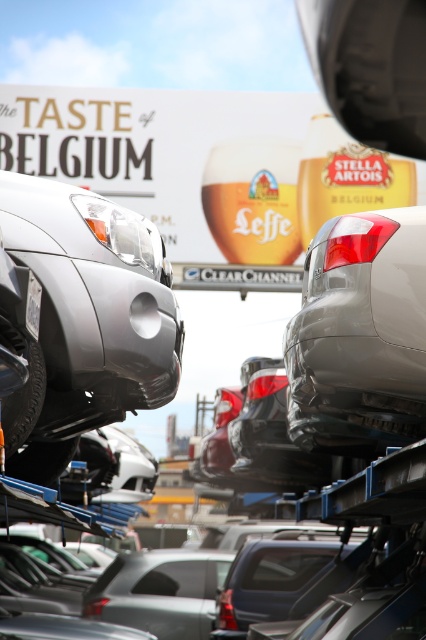
Question: Is satin silver car at left to the right of white plastic license plate at center from the viewer's perspective?

Choices:
 (A) yes
 (B) no

Answer: (B)

Question: Among these points, which one is farthest from the camera?

Choices:
 (A) (25, 308)
 (B) (146, 291)

Answer: (B)

Question: Which object appears closest to the camera in this image?

Choices:
 (A) white plastic license plate at center
 (B) satin silver car at upper right

Answer: (A)

Question: Is satin silver car at upper right below white plastic license plate at center?

Choices:
 (A) no
 (B) yes

Answer: (B)

Question: Does satin silver car at left appear over satin silver car at upper right?

Choices:
 (A) yes
 (B) no

Answer: (A)

Question: Estimate the real-world distances between objects in this image. Which object is closer to the satin silver car at upper right?

Choices:
 (A) satin silver car at left
 (B) white plastic license plate at center

Answer: (A)